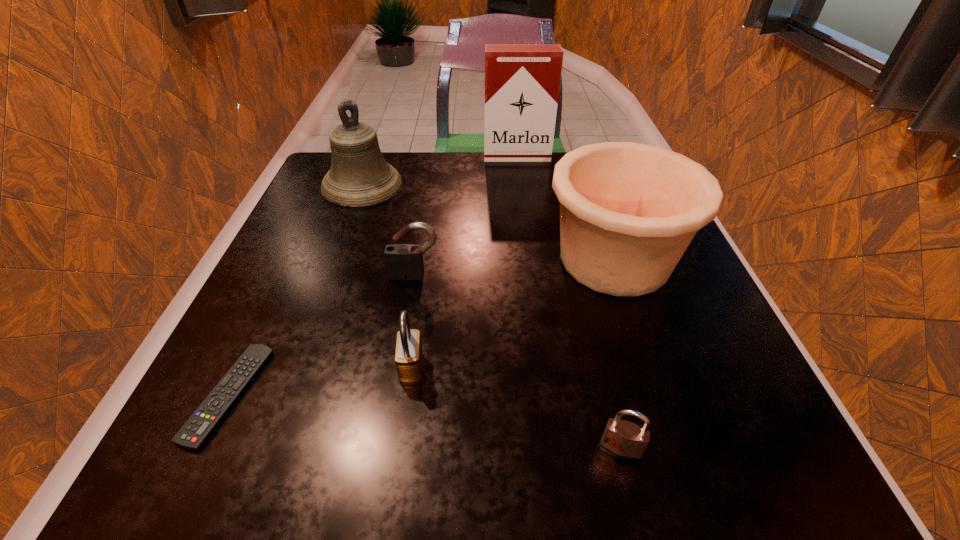
This screenshot has height=540, width=960. I want to click on vacant space situated 0.360m on the right of the bell, so click(x=554, y=185).

This screenshot has height=540, width=960. In order to click on vacant space situated on the left of the pottery in this screenshot , I will do `click(382, 260)`.

At what (x,y) coordinates should I click in order to perform the action: click on vacant space positioned 0.320m with the keyhole on the front of the farthest padlock. Please return your answer as a coordinate pair (x, y). Looking at the image, I should click on (387, 450).

At what (x,y) coordinates should I click in order to perform the action: click on vacant space located 0.080m on the back of the second nearest padlock. Please return your answer as a coordinate pair (x, y). Looking at the image, I should click on (419, 314).

At what (x,y) coordinates should I click in order to perform the action: click on free point located 0.110m on the back of the rightmost padlock. Please return your answer as a coordinate pair (x, y). Looking at the image, I should click on (600, 368).

Locate an element on the screen. free point located 0.050m on the right of the shortest object is located at coordinates (291, 395).

Image resolution: width=960 pixels, height=540 pixels. What are the coordinates of `cigarette_case present at the far edge` in the screenshot? It's located at (522, 81).

At what (x,y) coordinates should I click in order to perform the action: click on bell at the far edge. Please return your answer as a coordinate pair (x, y). Looking at the image, I should click on (359, 176).

You are a GUI agent. You are given a task and a screenshot of the screen. Output one action in this format:
    pyautogui.click(x=<x>, y=<y>)
    Task: Click on the padlock at the near edge
    This screenshot has width=960, height=540.
    Given the screenshot: What is the action you would take?
    (x=623, y=440)

Where is `remote control positioned at the near edge`? The height and width of the screenshot is (540, 960). remote control positioned at the near edge is located at coordinates (197, 430).